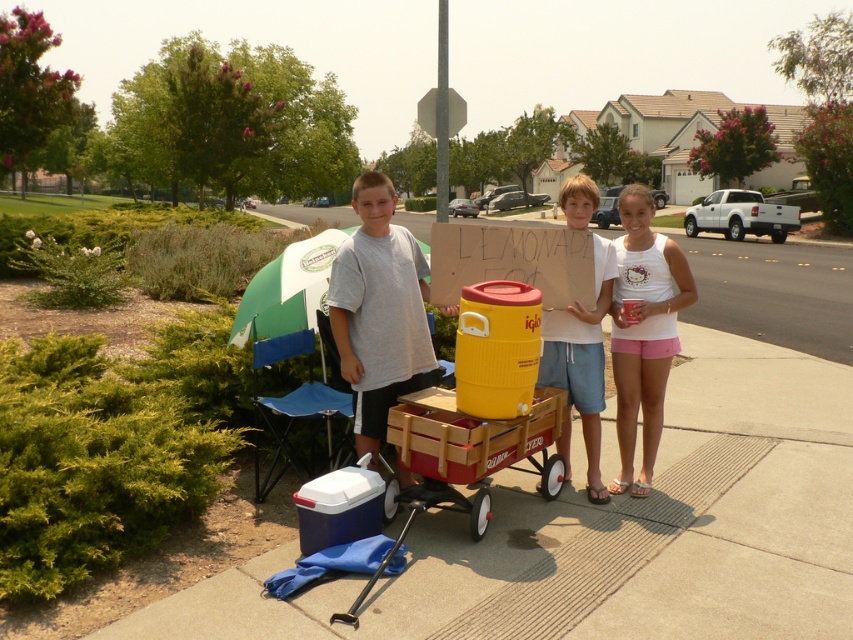
Can you confirm if white cotton tank top at center is wider than light blue denim shorts at center?

Indeed, white cotton tank top at center has a greater width compared to light blue denim shorts at center.

Can you confirm if white cotton tank top at center is positioned below light blue denim shorts at center?

Yes.

Where is `white cotton tank top at center`? This screenshot has height=640, width=853. white cotton tank top at center is located at coordinates (643, 332).

Does wooden wagon at center appear over white cotton tank top at center?

Actually, wooden wagon at center is below white cotton tank top at center.

Between wooden wagon at center and white cotton tank top at center, which one appears on the right side from the viewer's perspective?

white cotton tank top at center

The height and width of the screenshot is (640, 853). What do you see at coordinates (463, 460) in the screenshot?
I see `wooden wagon at center` at bounding box center [463, 460].

Where is `wooden wagon at center`? Image resolution: width=853 pixels, height=640 pixels. wooden wagon at center is located at coordinates (463, 460).

Does point (386, 397) lie behind point (488, 452)?

Yes, it is.

Is gray cotton t-shirt at center behind wooden wagon at center?

That is True.

Is point (335, 273) closer to viewer compared to point (489, 461)?

No, (335, 273) is further to viewer.

Where is `gray cotton t-shirt at center`? gray cotton t-shirt at center is located at coordinates (379, 310).